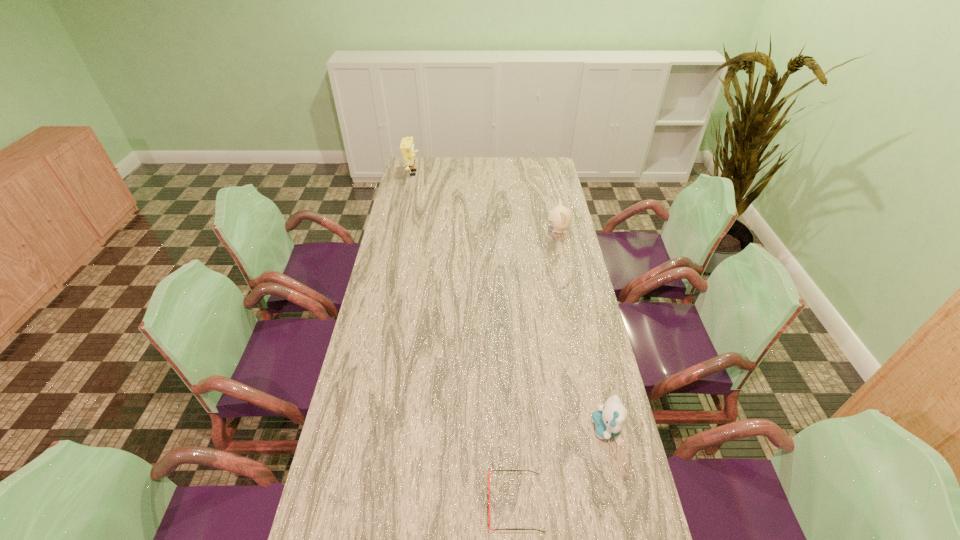
Where is `vacant area between the spectacles and the third farthest object`? vacant area between the spectacles and the third farthest object is located at coordinates (561, 467).

At what (x,y) coordinates should I click in order to perform the action: click on vacant point located between the farthest object and the spectacles. Please return your answer as a coordinate pair (x, y). Looking at the image, I should click on (464, 338).

Locate which object is the closest to the leftmost object. Please provide its 2D coordinates. Your answer should be formatted as a tuple, i.e. [(x, y)], where the tuple contains the x and y coordinates of a point satisfying the conditions above.

[(559, 218)]

The image size is (960, 540). Find the location of `object that is the closest to the farther kitten`. object that is the closest to the farther kitten is located at coordinates (407, 148).